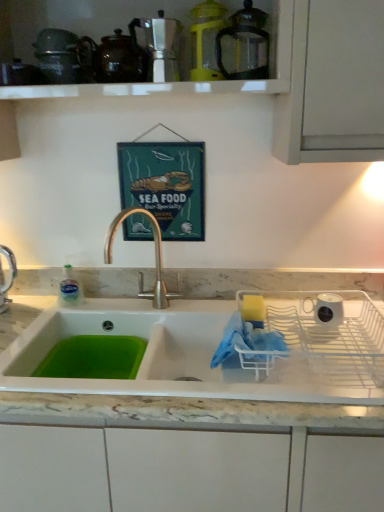
Question: Is white ceramic sink at center at the right side of white ceramic mug at right, the 1th appliance ordered from the bottom?

Choices:
 (A) yes
 (B) no

Answer: (B)

Question: Is white ceramic sink at center taller than white ceramic mug at right, the first appliance from the right?

Choices:
 (A) yes
 (B) no

Answer: (A)

Question: From a real-world perspective, is white ceramic sink at center positioned over white ceramic mug at right, the 1th appliance ordered from the bottom, based on gravity?

Choices:
 (A) no
 (B) yes

Answer: (B)

Question: Is white ceramic sink at center oriented towards white ceramic mug at right, the first appliance from the right?

Choices:
 (A) yes
 (B) no

Answer: (B)

Question: Is white ceramic sink at center closer to the viewer compared to white ceramic mug at right, the first appliance from the right?

Choices:
 (A) no
 (B) yes

Answer: (B)

Question: Is brown glossy teapot at upper center to the left or to the right of white ceramic sink at center in the image?

Choices:
 (A) right
 (B) left

Answer: (B)

Question: In terms of width, does brown glossy teapot at upper center look wider or thinner when compared to white ceramic sink at center?

Choices:
 (A) wide
 (B) thin

Answer: (B)

Question: From their relative heights in the image, would you say brown glossy teapot at upper center is taller or shorter than white ceramic sink at center?

Choices:
 (A) tall
 (B) short

Answer: (B)

Question: From the image's perspective, is brown glossy teapot at upper center located above or below white ceramic sink at center?

Choices:
 (A) below
 (B) above

Answer: (B)

Question: Is white ceramic mug at right, the 1th appliance ordered from the bottom, wider or thinner than yellow plastic blender at upper center, acting as the 2th appliance starting from the left?

Choices:
 (A) wide
 (B) thin

Answer: (B)

Question: Is white ceramic mug at right, the 1th appliance ordered from the bottom, inside or outside of yellow plastic blender at upper center, arranged as the 1th appliance when viewed from the top?

Choices:
 (A) inside
 (B) outside

Answer: (B)

Question: In terms of height, does white ceramic mug at right, the 1th appliance ordered from the bottom, look taller or shorter compared to yellow plastic blender at upper center, acting as the 4th appliance starting from the bottom?

Choices:
 (A) short
 (B) tall

Answer: (A)

Question: From the image's perspective, is white ceramic mug at right, the first appliance from the right, positioned above or below yellow plastic blender at upper center, acting as the 2th appliance starting from the left?

Choices:
 (A) below
 (B) above

Answer: (A)

Question: From the image's perspective, is brown glossy teapot at upper center above or below metallic silver coffee maker at upper center, placed as the second appliance when sorted from bottom to top?

Choices:
 (A) below
 (B) above

Answer: (A)

Question: Looking at the image, does brown glossy teapot at upper center seem bigger or smaller compared to metallic silver coffee maker at upper center, which ranks as the first appliance in left-to-right order?

Choices:
 (A) small
 (B) big

Answer: (B)